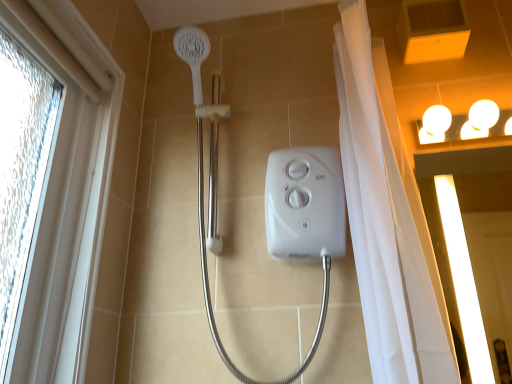
Question: Does white textured window at left lie behind white glossy screen door at upper right?

Choices:
 (A) no
 (B) yes

Answer: (A)

Question: From a real-world perspective, is white textured window at left positioned over white glossy screen door at upper right based on gravity?

Choices:
 (A) no
 (B) yes

Answer: (B)

Question: Are white textured window at left and white glossy screen door at upper right beside each other?

Choices:
 (A) no
 (B) yes

Answer: (A)

Question: From the image's perspective, is white textured window at left located beneath white glossy screen door at upper right?

Choices:
 (A) no
 (B) yes

Answer: (A)

Question: Is white textured window at left oriented away from white glossy screen door at upper right?

Choices:
 (A) yes
 (B) no

Answer: (B)

Question: Would you say white glossy screen door at upper right is to the left or to the right of white textured window at left in the picture?

Choices:
 (A) left
 (B) right

Answer: (B)

Question: In terms of width, does white glossy screen door at upper right look wider or thinner when compared to white textured window at left?

Choices:
 (A) wide
 (B) thin

Answer: (B)

Question: Is white glossy screen door at upper right taller or shorter than white textured window at left?

Choices:
 (A) tall
 (B) short

Answer: (B)

Question: Would you say white glossy screen door at upper right is inside or outside white textured window at left?

Choices:
 (A) inside
 (B) outside

Answer: (B)

Question: Based on their positions, is white glossy light fixture at upper right located to the left or right of white glossy screen door at upper right?

Choices:
 (A) right
 (B) left

Answer: (A)

Question: Looking at their shapes, would you say white glossy light fixture at upper right is wider or thinner than white glossy screen door at upper right?

Choices:
 (A) wide
 (B) thin

Answer: (A)

Question: Relative to white glossy screen door at upper right, is white glossy light fixture at upper right in front or behind?

Choices:
 (A) front
 (B) behind

Answer: (B)

Question: Is point (481, 127) closer or farther from the camera than point (428, 192)?

Choices:
 (A) farther
 (B) closer

Answer: (B)

Question: From a real-world perspective, is white textured window at left positioned above or below white glossy light fixture at upper right?

Choices:
 (A) above
 (B) below

Answer: (B)

Question: Is white textured window at left taller or shorter than white glossy light fixture at upper right?

Choices:
 (A) short
 (B) tall

Answer: (B)